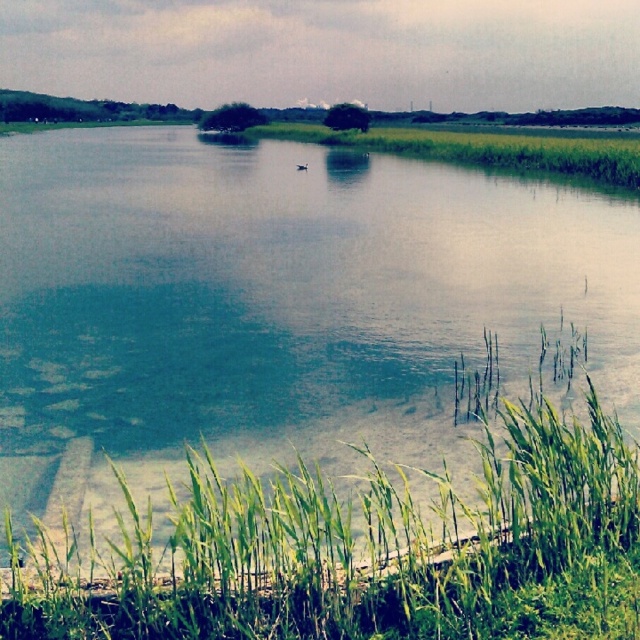
Question: Which point is closer to the camera?

Choices:
 (A) (458, 132)
 (B) (102, 504)
 (C) (200, 580)

Answer: (C)

Question: Which point is farther from the camera taking this photo?

Choices:
 (A) (616, 173)
 (B) (244, 150)

Answer: (B)

Question: Is clear water at center smaller than green grass at lower right?

Choices:
 (A) yes
 (B) no

Answer: (B)

Question: Can you confirm if clear water at center is smaller than green grass at lower right?

Choices:
 (A) yes
 (B) no

Answer: (B)

Question: Which of the following is the farthest from the observer?

Choices:
 (A) (248, 625)
 (B) (419, 310)

Answer: (B)

Question: From the image, what is the correct spatial relationship of clear water at center in relation to green grass at center?

Choices:
 (A) below
 (B) above

Answer: (A)